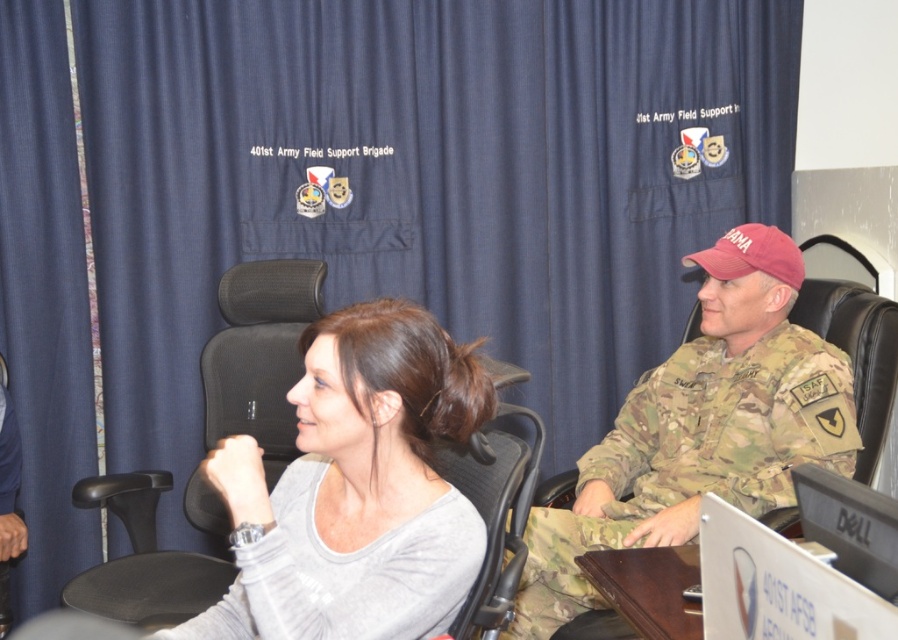
You are sitting in the black mesh swivel chair at left. You want to place a document on the brown wood table at lower center. Can you reach it without moving from your current position?

The brown wood table at lower center is behind the black mesh swivel chair at left, so you cannot reach it without moving from your current position because it is located behind you.

You are a visitor entering the room and need to sit down. There is a black mesh swivel chair at left and a brown wood table at lower center. Which object should you approach first to sit in the chair?

You should approach the black mesh swivel chair at left first because it is located to the left of the brown wood table at lower center, meaning it is positioned further to the left side of the room.

You are a photographer adjusting your camera settings to capture a clear image of two points in a scene. The points are labeled as point [298,524] and point [266,467]. Which point should you focus on first to ensure both are in focus, given their depth positions?

Result: You should focus on point [298,524] first because it is closer to the camera than point [266,467]. This ensures the closer point is in focus, and with proper depth of field, the farther point may also be captured clearly.